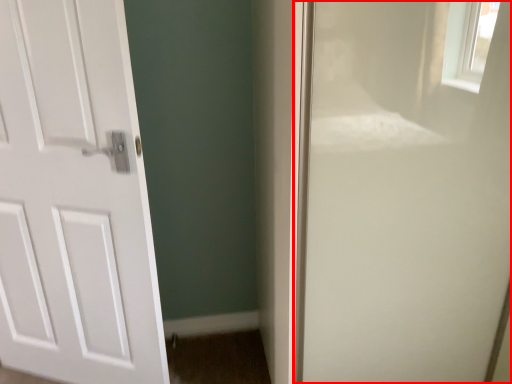
Question: Where is screen door (annotated by the red box) located in relation to door in the image?

Choices:
 (A) right
 (B) left

Answer: (A)